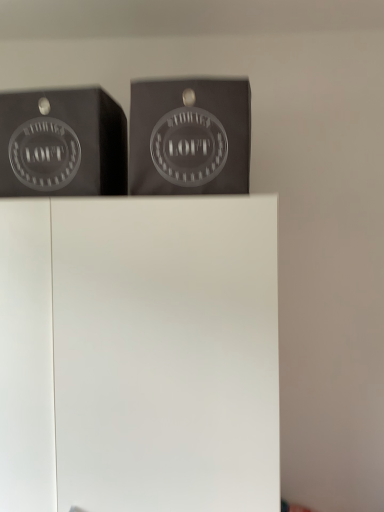
Question: Is matte black logo at upper left not inside white matte cabinet at center?

Choices:
 (A) no
 (B) yes

Answer: (B)

Question: Does matte black logo at upper left come in front of white matte cabinet at center?

Choices:
 (A) no
 (B) yes

Answer: (A)

Question: Is matte black logo at upper left positioned with its back to white matte cabinet at center?

Choices:
 (A) no
 (B) yes

Answer: (A)

Question: Can you confirm if matte black logo at upper left is positioned to the right of white matte cabinet at center?

Choices:
 (A) yes
 (B) no

Answer: (B)

Question: Is matte black logo at upper left beside white matte cabinet at center?

Choices:
 (A) yes
 (B) no

Answer: (B)

Question: Can you confirm if matte black logo at upper left is bigger than white matte cabinet at center?

Choices:
 (A) no
 (B) yes

Answer: (A)

Question: Considering the relative sizes of matte black box at upper center and white matte cabinet at center in the image provided, is matte black box at upper center thinner than white matte cabinet at center?

Choices:
 (A) yes
 (B) no

Answer: (A)

Question: Would you say matte black box at upper center is a long distance from white matte cabinet at center?

Choices:
 (A) yes
 (B) no

Answer: (B)

Question: Can white matte cabinet at center be found inside matte black box at upper center?

Choices:
 (A) no
 (B) yes

Answer: (A)

Question: Is matte black box at upper center aimed at white matte cabinet at center?

Choices:
 (A) no
 (B) yes

Answer: (A)

Question: Is the depth of matte black box at upper center less than that of white matte cabinet at center?

Choices:
 (A) no
 (B) yes

Answer: (B)

Question: Considering the relative sizes of matte black box at upper center and white matte cabinet at center in the image provided, is matte black box at upper center bigger than white matte cabinet at center?

Choices:
 (A) yes
 (B) no

Answer: (B)

Question: From the image's perspective, is matte black box at upper center under matte black logo at upper left?

Choices:
 (A) yes
 (B) no

Answer: (A)